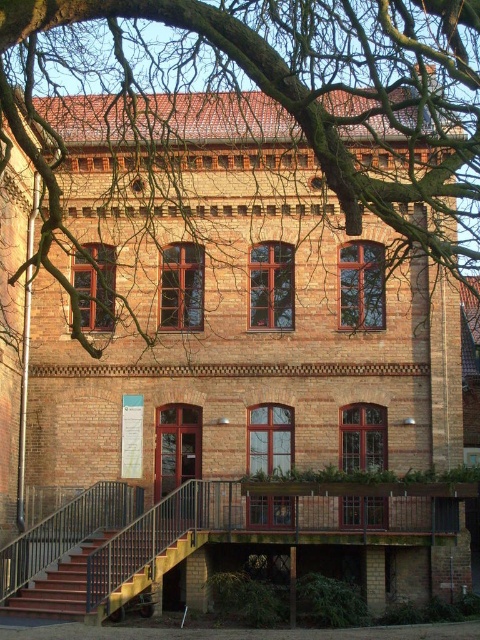
You are standing in front of the two story brick building and want to determine the relative positions of two points marked on the facade. Which point is closer to you, point (62,230) or point (48,566)?

Point (62,230) is closer to the viewer than point (48,566).

You are standing in front of the building and want to take a closer look at the bare branches at center and the wooden stairs at lower left. Which object would you need to walk towards first to get closer to both?

You should first walk towards the wooden stairs at lower left because the bare branches at center are closer to you than the wooden stairs at lower left. Since you need to get closer to both, moving towards the stairs would allow you to approach both objects simultaneously, but since the branches are already closer, you might need to adjust your path accordingly. However, based on the given information, the answer should prioritize the closer object first.

You are standing in front of the two story brick building. There is a bare branches at center represented by point [289,92]. Where is the bare branches at center located in relation to the building?

The bare branches at center represented by point [289,92] is located at the center of the image, which is in front of the two story brick building.